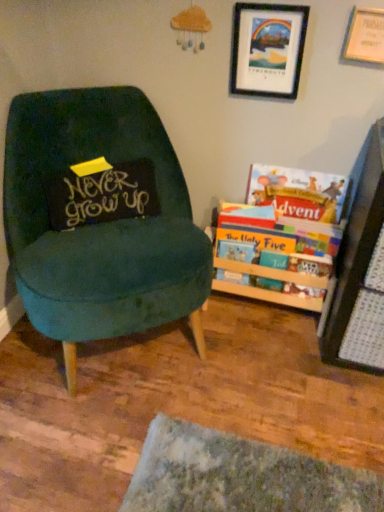
I want to click on black fabric pillow at left, so click(101, 193).

The width and height of the screenshot is (384, 512). I want to click on teal velvet chair at left, so click(100, 219).

What do you see at coordinates (298, 191) in the screenshot?
I see `hardcover book at right, acting as the 1th book starting from the top` at bounding box center [298, 191].

How much space does black matte picture frame at upper right, the 2th picture frame viewed from the right, occupy horizontally?

The width of black matte picture frame at upper right, the 2th picture frame viewed from the right, is 1.27 inches.

Locate an element on the screen. The image size is (384, 512). hardcover book at right, the third book from the top is located at coordinates click(x=269, y=264).

Is hardcover book at right, which ranks as the 3th book in bottom-to-top order, inside the boundaries of hardcover book at right, the third book from the top, or outside?

The correct answer is: outside.

Considering the positions of point (321, 190) and point (309, 271), is point (321, 190) closer or farther from the camera than point (309, 271)?

Clearly, point (321, 190) is more distant from the camera than point (309, 271).

Locate an element on the screen. The height and width of the screenshot is (512, 384). the 2nd book below the hardcover book at right, which ranks as the 3th book in bottom-to-top order (from the image's perspective) is located at coordinates (269, 264).

From the picture: Is hardcover book at right, acting as the 1th book starting from the top, turned away from hardcover book at right, the third book from the top?

No, hardcover book at right, acting as the 1th book starting from the top, is not facing away from hardcover book at right, the third book from the top.

Is wooden picture frame at upper right, positioned as the first picture frame in right-to-left order, beside black matte picture frame at upper right, placed as the 1th picture frame when sorted from left to right?

They are not placed beside each other.

Between wooden picture frame at upper right, positioned as the first picture frame in right-to-left order, and black matte picture frame at upper right, placed as the 1th picture frame when sorted from left to right, which one is positioned behind?

black matte picture frame at upper right, placed as the 1th picture frame when sorted from left to right, is more distant.

From a real-world perspective, is wooden picture frame at upper right, positioned as the first picture frame in right-to-left order, located higher than black matte picture frame at upper right, placed as the 1th picture frame when sorted from left to right?

Yes, from a real-world perspective, wooden picture frame at upper right, positioned as the first picture frame in right-to-left order, is over black matte picture frame at upper right, placed as the 1th picture frame when sorted from left to right

How distant is wooden picture frame at upper right, positioned as the first picture frame in right-to-left order, from black matte picture frame at upper right, the 2th picture frame viewed from the right?

24.04 centimeters.

Considering the points (346, 53) and (251, 258), which point is behind, point (346, 53) or point (251, 258)?

The point (251, 258) is farther from the camera.

Is wooden picture frame at upper right, the 2th picture frame from the left, aimed at hardcover book at right, the 1th book in the bottom-to-top sequence?

No, wooden picture frame at upper right, the 2th picture frame from the left, is not facing towards hardcover book at right, the 1th book in the bottom-to-top sequence.

From the image's perspective, relative to hardcover book at right, the 1th book in the bottom-to-top sequence, is wooden picture frame at upper right, the 2th picture frame from the left, above or below?

Clearly, from the image's perspective, wooden picture frame at upper right, the 2th picture frame from the left, is above hardcover book at right, the 1th book in the bottom-to-top sequence.

Does wooden picture frame at upper right, the 2th picture frame from the left, have a larger size compared to hardcover book at right, the third book from the top?

Incorrect, wooden picture frame at upper right, the 2th picture frame from the left, is not larger than hardcover book at right, the third book from the top.

Which point is more distant from viewer, (227, 255) or (266, 236)?

The point (227, 255) is more distant.

This screenshot has width=384, height=512. I want to click on book on the left of hardcover book at right, the third book from the top, so click(280, 236).

Are hardcover book at right, the third book from the top, and hardcover book at right, which is the 2th book in bottom-to-top order, beside each other?

Yes, hardcover book at right, the third book from the top, is in contact with hardcover book at right, which is the 2th book in bottom-to-top order.

Is hardcover book at right, the 1th book in the bottom-to-top sequence, inside or outside of hardcover book at right, which is the 2th book in bottom-to-top order?

hardcover book at right, the 1th book in the bottom-to-top sequence, can be found inside hardcover book at right, which is the 2th book in bottom-to-top order.

Does point (112, 322) come closer to viewer compared to point (286, 173)?

Yes, point (112, 322) is closer to viewer.

Considering the relative positions of teal velvet chair at left and hardcover book at right, which ranks as the 3th book in bottom-to-top order, in the image provided, is teal velvet chair at left behind hardcover book at right, which ranks as the 3th book in bottom-to-top order,?

No, the depth of teal velvet chair at left is less than that of hardcover book at right, which ranks as the 3th book in bottom-to-top order.

Between teal velvet chair at left and hardcover book at right, which ranks as the 3th book in bottom-to-top order, which one appears on the right side from the viewer's perspective?

hardcover book at right, which ranks as the 3th book in bottom-to-top order.

Is teal velvet chair at left situated inside hardcover book at right, acting as the 1th book starting from the top, or outside?

teal velvet chair at left is not inside hardcover book at right, acting as the 1th book starting from the top, it's outside.

Which object is thinner, hardcover book at right, the 1th book in the bottom-to-top sequence, or hardcover book at right, acting as the 1th book starting from the top?

Thinner between the two is hardcover book at right, acting as the 1th book starting from the top.

From a real-world perspective, who is located lower, hardcover book at right, the third book from the top, or hardcover book at right, which ranks as the 3th book in bottom-to-top order?

In real-world perspective, hardcover book at right, the third book from the top, is lower.

Do you think teal velvet chair at left is within black fabric pillow at left, or outside of it?

The correct answer is: outside.

Considering the sizes of teal velvet chair at left and black fabric pillow at left in the image, is teal velvet chair at left bigger or smaller than black fabric pillow at left?

Clearly, teal velvet chair at left is larger in size than black fabric pillow at left.

Is teal velvet chair at left positioned with its back to black fabric pillow at left?

Yes, teal velvet chair at left's orientation is away from black fabric pillow at left.

Starting from the hardcover book at right, the third book from the top, which book is the 1st one in front? Please provide its 2D coordinates.

[(298, 191)]

In the image, there is a wooden picture frame at upper right, the 2th picture frame from the left. At what (x,y) coordinates should I click in order to perform the action: click on picture frame above it (from the image's perspective). Please return your answer as a coordinate pair (x, y). Image resolution: width=384 pixels, height=512 pixels. Looking at the image, I should click on (267, 49).

Looking at the image, which one is located further to teal velvet chair at left, black fabric pillow at left or wooden picture frame at upper right, the 2th picture frame from the left?

wooden picture frame at upper right, the 2th picture frame from the left, is positioned further to the anchor teal velvet chair at left.

When comparing their distances from hardcover book at right, which ranks as the 3th book in bottom-to-top order, does wooden picture frame at upper right, positioned as the first picture frame in right-to-left order, or hardcover book at right, the third book from the top, seem closer?

hardcover book at right, the third book from the top.

When comparing their distances from hardcover book at right, placed as the 2th book when sorted from top to bottom, does hardcover book at right, which ranks as the 3th book in bottom-to-top order, or hardcover book at right, the 1th book in the bottom-to-top sequence, seem further?

Based on the image, hardcover book at right, which ranks as the 3th book in bottom-to-top order, appears to be further to hardcover book at right, placed as the 2th book when sorted from top to bottom.

Looking at this image, when comparing their distances from hardcover book at right, the 1th book in the bottom-to-top sequence, does hardcover book at right, placed as the 2th book when sorted from top to bottom, or black matte picture frame at upper right, placed as the 1th picture frame when sorted from left to right, seem further?

black matte picture frame at upper right, placed as the 1th picture frame when sorted from left to right, is further to hardcover book at right, the 1th book in the bottom-to-top sequence.

Which object lies nearer to the anchor point black matte picture frame at upper right, placed as the 1th picture frame when sorted from left to right, hardcover book at right, which ranks as the 3th book in bottom-to-top order, or teal velvet chair at left?

hardcover book at right, which ranks as the 3th book in bottom-to-top order, is closer to black matte picture frame at upper right, placed as the 1th picture frame when sorted from left to right.

Based on their spatial positions, is black matte picture frame at upper right, the 2th picture frame viewed from the right, or hardcover book at right, the 1th book in the bottom-to-top sequence, closer to wooden picture frame at upper right, the 2th picture frame from the left?

Based on the image, black matte picture frame at upper right, the 2th picture frame viewed from the right, appears to be nearer to wooden picture frame at upper right, the 2th picture frame from the left.

Estimate the real-world distances between objects in this image. Which object is closer to hardcover book at right, the 1th book in the bottom-to-top sequence, hardcover book at right, acting as the 1th book starting from the top, or teal velvet chair at left?

The object closer to hardcover book at right, the 1th book in the bottom-to-top sequence, is hardcover book at right, acting as the 1th book starting from the top.

Based on their spatial positions, is hardcover book at right, placed as the 2th book when sorted from top to bottom, or black fabric pillow at left closer to hardcover book at right, acting as the 1th book starting from the top?

The object closer to hardcover book at right, acting as the 1th book starting from the top, is hardcover book at right, placed as the 2th book when sorted from top to bottom.

The width and height of the screenshot is (384, 512). In order to click on picture frame between black matte picture frame at upper right, placed as the 1th picture frame when sorted from left to right, and hardcover book at right, which is the 2th book in bottom-to-top order, in the up-down direction in this screenshot , I will do `click(365, 36)`.

Locate an element on the screen. The width and height of the screenshot is (384, 512). picture frame between black fabric pillow at left and hardcover book at right, which ranks as the 3th book in bottom-to-top order is located at coordinates (267, 49).

What are the coordinates of `book situated between black fabric pillow at left and hardcover book at right, the 1th book in the bottom-to-top sequence, from left to right` in the screenshot? It's located at (280, 236).

Identify the location of book between black matte picture frame at upper right, the 2th picture frame viewed from the right, and hardcover book at right, which is the 2th book in bottom-to-top order, vertically. (298, 191).